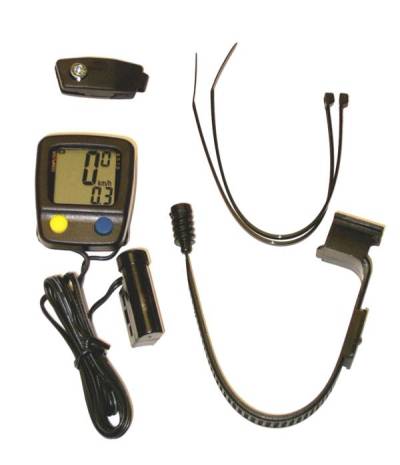
Identify the location of cord. (74, 300).